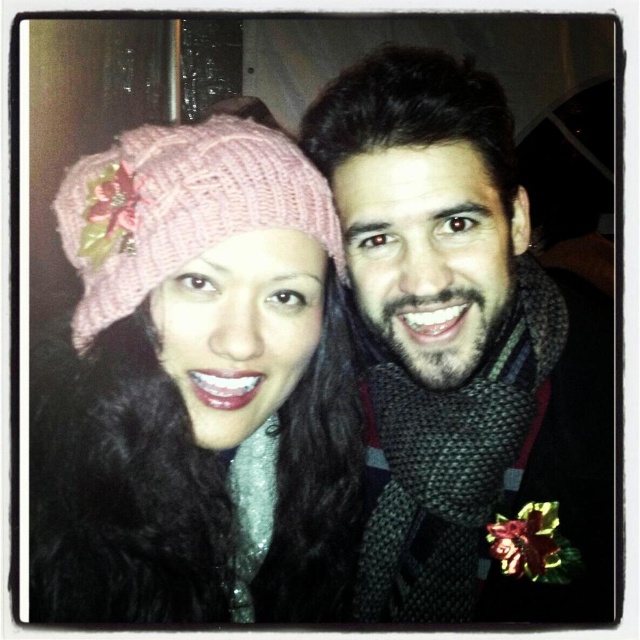
You are taking a photo of two people standing close together. The person on the left has a pink hat with a flower and a black fur coat. The person on the right has short hair and a dark scarf with a floral pin. You notice a point at coordinates (461, 339). What object does this point correspond to?

The point at coordinates (461, 339) corresponds to the knitted scarf at center.

You are a photographer trying to focus on the pink knitted hat at upper left and the pink knitted hat at left. Which hat should you adjust your focus to first if you want to ensure both are in frame but prioritize the larger one?

The pink knitted hat at upper left is bigger than the pink knitted hat at left, so you should focus on the pink knitted hat at upper left first to ensure it is in frame and properly captured.

You are a photographer adjusting the lighting for a portrait. You notice the knitted scarf at center and the pink knitted hat at left. Which object is closer to the camera based on their positions?

The pink knitted hat at left is closer to the camera because it is positioned above the knitted scarf at center, which is below it.